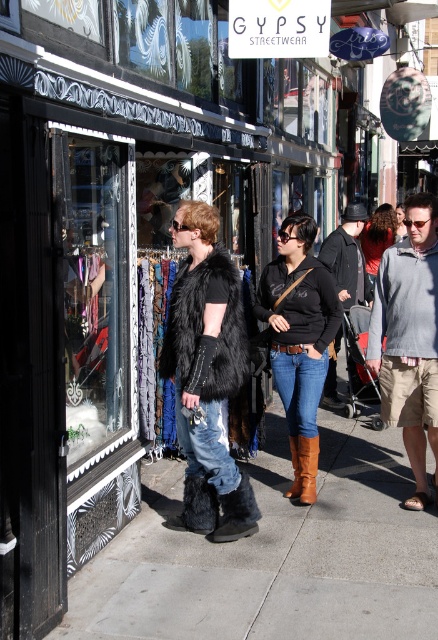
Between point (339, 340) and point (363, 250), which one is positioned in front?

Point (339, 340) is more forward.

Is point (357, 234) positioned behind point (368, 236)?

No, (357, 234) is in front of (368, 236).

The image size is (438, 640). Find the location of `black leather jacket at center`. black leather jacket at center is located at coordinates (348, 257).

Locate an element on the screen. The height and width of the screenshot is (640, 438). black leather jacket at center is located at coordinates (348, 257).

Is black leather jacket at center in front of brown leather boot at lower center?

No, black leather jacket at center is behind brown leather boot at lower center.

Who is more forward, (367, 296) or (292, 496)?

Positioned in front is point (292, 496).

This screenshot has width=438, height=640. Find the location of `black leather jacket at center`. black leather jacket at center is located at coordinates (348, 257).

Who is more distant from viewer, [243,515] or [290,444]?

Point [290,444]

Who is positioned more to the left, black suede boot at lower center or brown leather boot at lower center?

black suede boot at lower center

Image resolution: width=438 pixels, height=640 pixels. What do you see at coordinates (236, 513) in the screenshot?
I see `black suede boot at lower center` at bounding box center [236, 513].

Where is `black suede boot at lower center`? Image resolution: width=438 pixels, height=640 pixels. black suede boot at lower center is located at coordinates (236, 513).